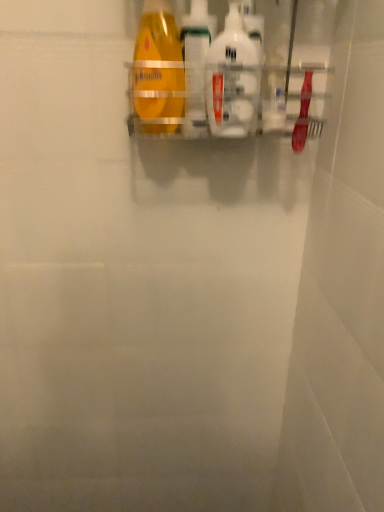
Question: From the image's perspective, is translucent plastic bottle at center, the 1th cleaning product in the left-to-right sequence, above or below yellow matte bottle at upper center?

Choices:
 (A) above
 (B) below

Answer: (A)

Question: Based on their sizes in the image, would you say translucent plastic bottle at center, the 1th cleaning product in the left-to-right sequence, is bigger or smaller than yellow matte bottle at upper center?

Choices:
 (A) small
 (B) big

Answer: (A)

Question: Which is nearer to the white glossy bottle at center, which appears as the 1th cleaning product when viewed from the right?

Choices:
 (A) yellow matte bottle at upper center
 (B) translucent plastic bottle at center, the 1th cleaning product in the left-to-right sequence

Answer: (B)

Question: Which is farther from the white glossy bottle at center, the second cleaning product in the left-to-right sequence?

Choices:
 (A) yellow matte bottle at upper center
 (B) translucent plastic bottle at center, the 1th cleaning product in the left-to-right sequence

Answer: (A)